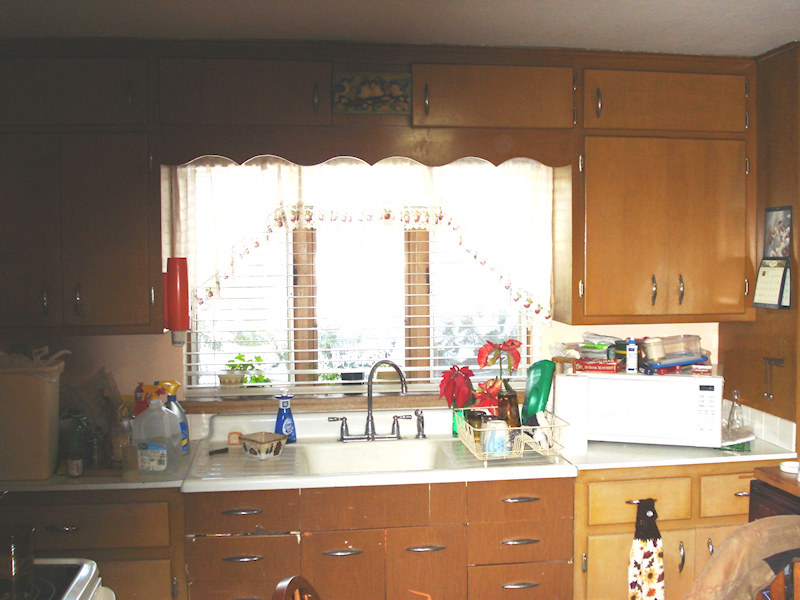
I want to click on white trash can, so click(42, 403).